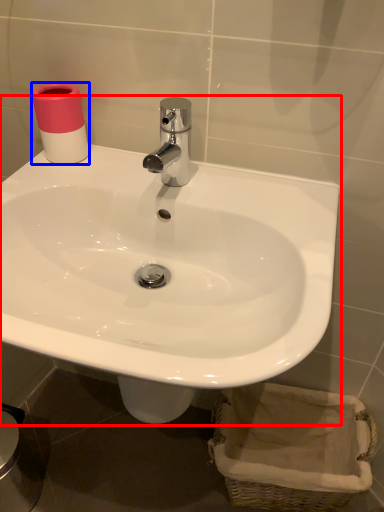
Question: Which object appears farthest to the camera in this image, sink (highlighted by a red box) or toilet paper (highlighted by a blue box)?

Choices:
 (A) sink
 (B) toilet paper

Answer: (B)